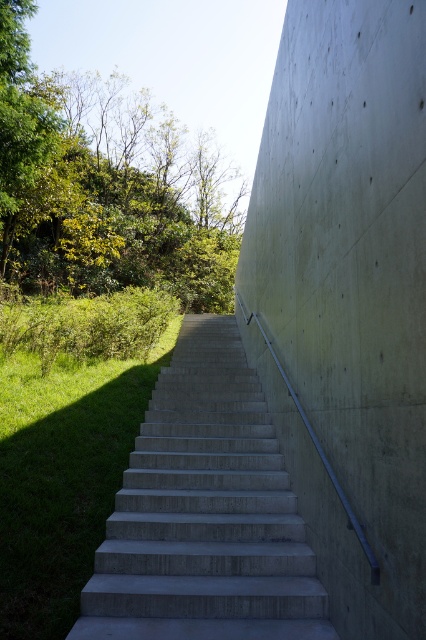
You are standing on the green grass at lower left and want to reach the top of the smooth concrete stairs at center. Which direction should you move to ascend the stairs?

The smooth concrete stairs at center are located above the green grass at lower left, so you should move towards the stairs in the upward direction to ascend.

You are standing at the base of the smooth concrete stairs at center and want to reach the green grass at lower left. Which direction should you move to get there?

The smooth concrete stairs at center is to the right of green grass at lower left, so you should move to the left to reach the green grass at lower left.